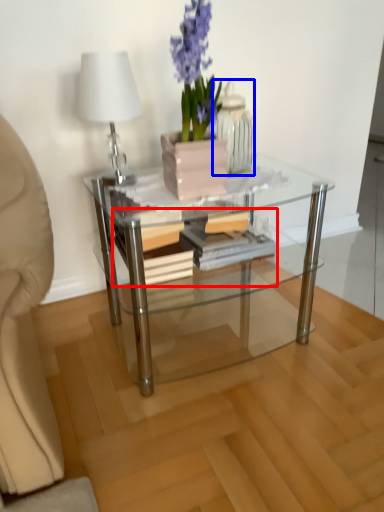
Question: Which object is further to the camera taking this photo, book (highlighted by a red box) or glass vase (highlighted by a blue box)?

Choices:
 (A) book
 (B) glass vase

Answer: (A)